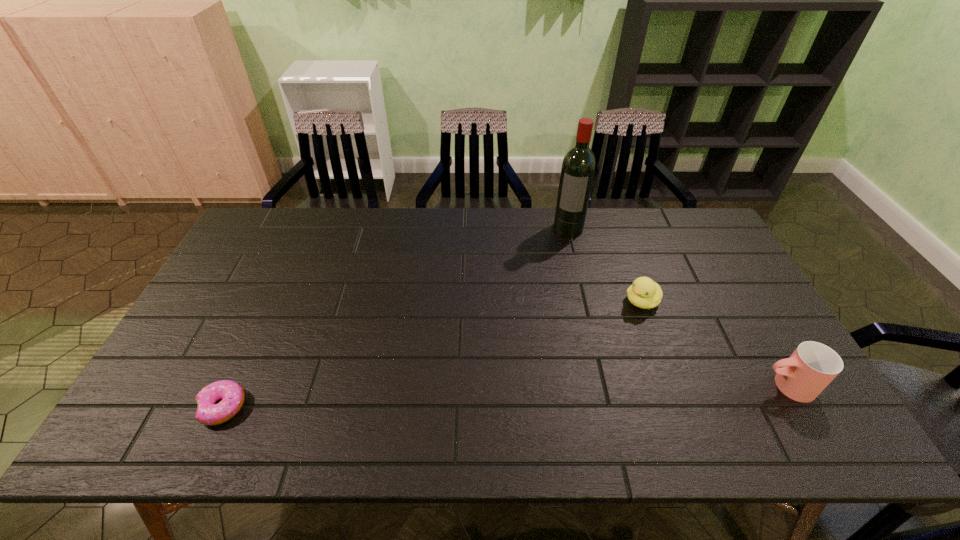
Identify the location of free space on the desktop that is between the leftmost object and the rightmost object and is positioned on the label of the wine bottle. The height and width of the screenshot is (540, 960). (519, 396).

The height and width of the screenshot is (540, 960). In order to click on vacant spot on the desktop that is between the shortest object and the cup and is positioned at the beak of the third tallest object in this screenshot , I will do `click(516, 396)`.